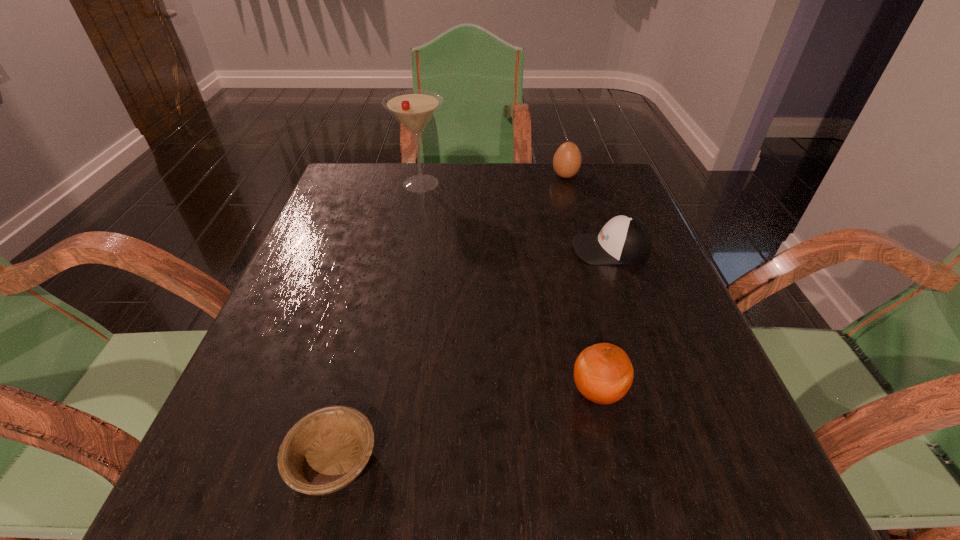
Locate an element on the screen. The width and height of the screenshot is (960, 540). empty space that is in between the fourth farthest object and the martini is located at coordinates (509, 287).

The image size is (960, 540). I want to click on unoccupied position between the nearest object and the orange, so click(466, 426).

Where is `vacant area that lies between the boiled egg and the tallest object`? vacant area that lies between the boiled egg and the tallest object is located at coordinates (492, 180).

What are the coordinates of `free space between the boiled egg and the orange` in the screenshot? It's located at (582, 284).

Where is `vacant area that lies between the orange and the boiled egg`? Image resolution: width=960 pixels, height=540 pixels. vacant area that lies between the orange and the boiled egg is located at coordinates (582, 284).

Where is `vacant area that lies between the bowl and the third farthest object`? The image size is (960, 540). vacant area that lies between the bowl and the third farthest object is located at coordinates (472, 355).

The image size is (960, 540). In order to click on free space that is in between the second shortest object and the tallest object in this screenshot , I will do `click(516, 216)`.

You are a GUI agent. You are given a task and a screenshot of the screen. Output one action in this format:
    pyautogui.click(x=<x>, y=<y>)
    Task: Click on the empty space between the tallest object and the boiled egg
    
    Given the screenshot: What is the action you would take?
    pyautogui.click(x=492, y=180)

The width and height of the screenshot is (960, 540). What are the coordinates of `vacant space in between the tallest object and the cap` in the screenshot? It's located at (516, 216).

Find the location of `the fourth closest object to the martini`. the fourth closest object to the martini is located at coordinates (327, 449).